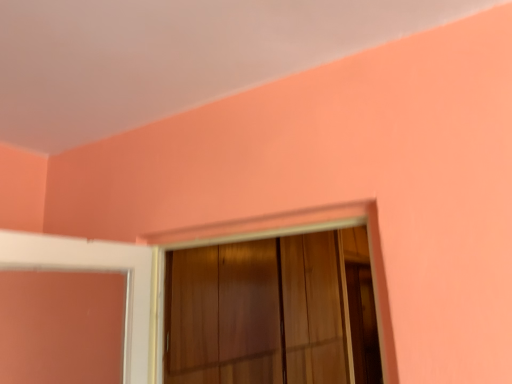
What do you see at coordinates (303, 232) in the screenshot?
I see `wooden at center` at bounding box center [303, 232].

I want to click on wooden at center, so click(303, 232).

The image size is (512, 384). What are the coordinates of `wooden at center` in the screenshot? It's located at (303, 232).